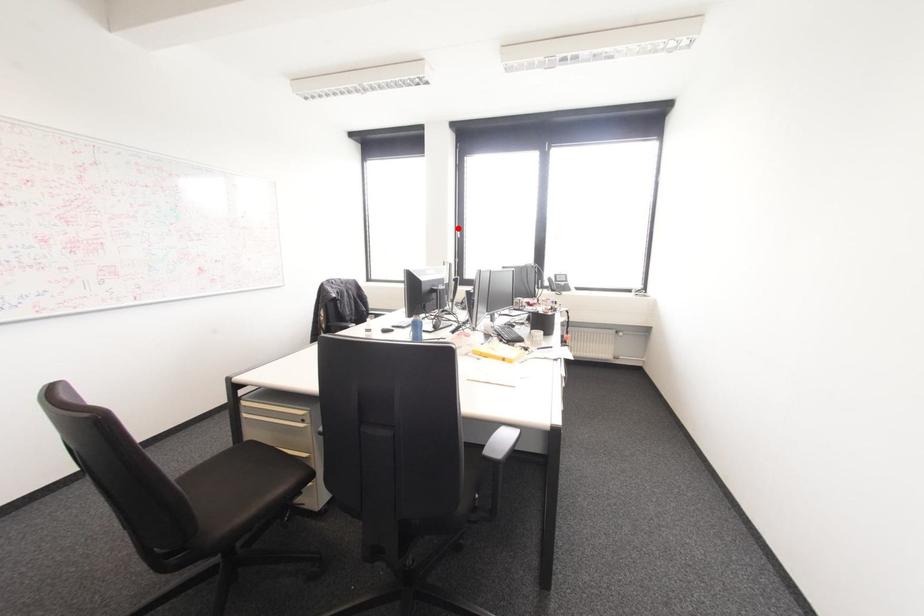
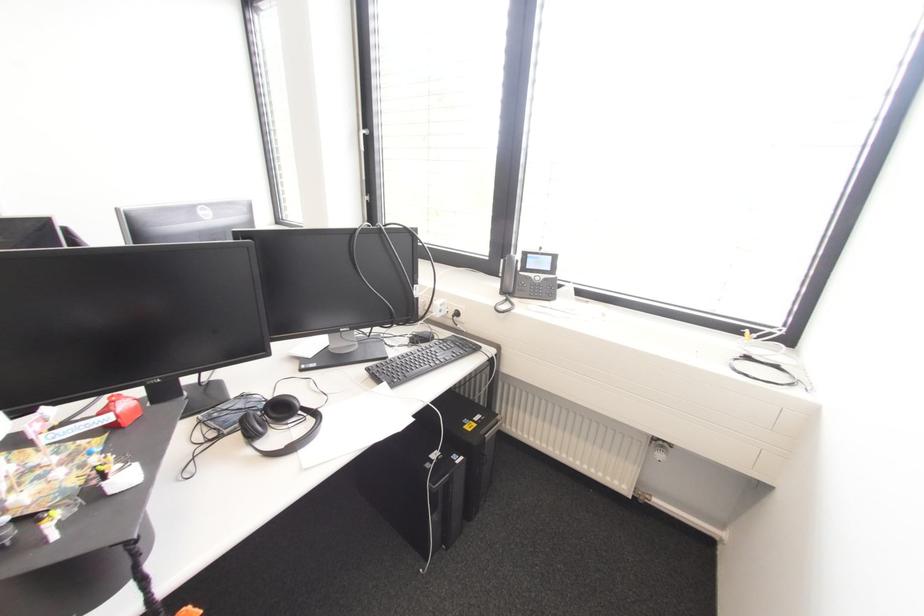
Locate, in the second image, the point that corresponds to the highlighted location in the first image.

(361, 132)